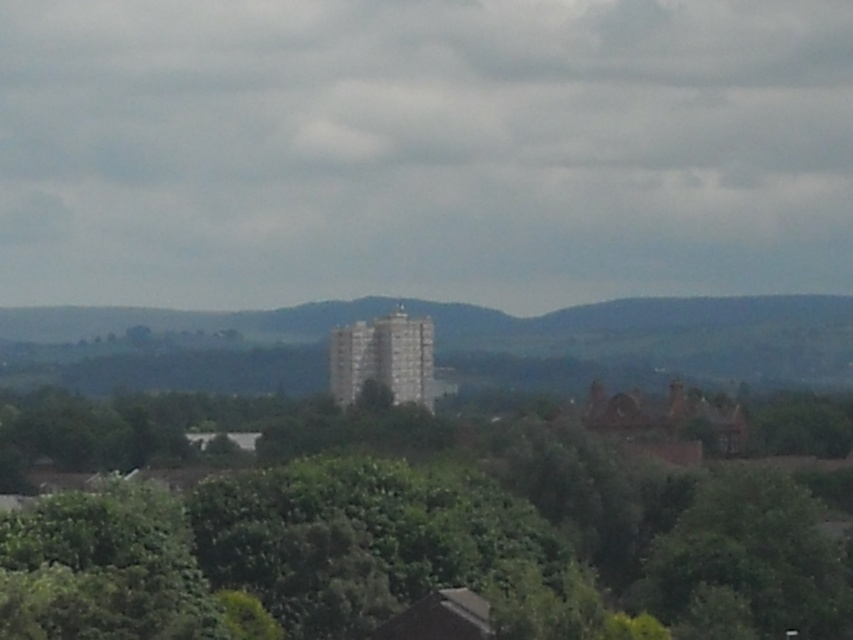
You are a landscape architect planning to plant a new tree between the green leafy tree at center and the green textured hill at center. If the recommended minimum spacing between trees is 100 meters, can you plant the new tree in this location?

The distance between the green leafy tree at center and the green textured hill at center is 83.80 meters. Since the recommended minimum spacing is 100 meters, planting a new tree between them would not meet the requirement as the current distance is less than the required spacing.

You are standing at the origin point of the image coordinate system, which is the bottom left corner. You want to locate the green leafy tree at center. What are its coordinates?

The coordinates of the green leafy tree at center are at point (430, 536).

You are standing in the park and see the green leafy tree at center and the green textured hill at center. Which one is positioned to the right side?

The green leafy tree at center is positioned to the right of the green textured hill at center.